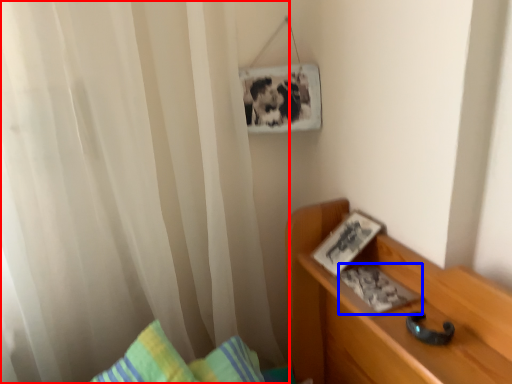
Question: Which point is closer to the camera, curtain (highlighted by a red box) or book (highlighted by a blue box)?

Choices:
 (A) curtain
 (B) book

Answer: (A)